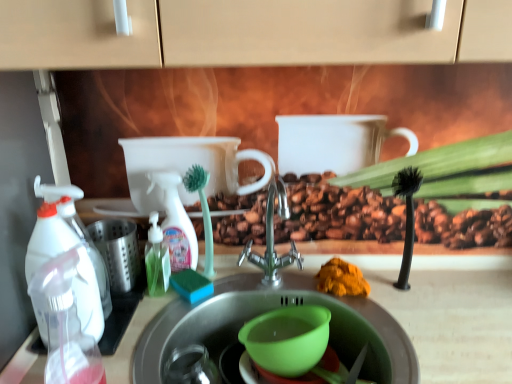
You are a GUI agent. You are given a task and a screenshot of the screen. Output one action in this format:
    pyautogui.click(x=<x>, y=<y>)
    Task: Click on the vacant space in front of orange powder at sink
    
    Given the screenshot: What is the action you would take?
    pyautogui.click(x=378, y=328)